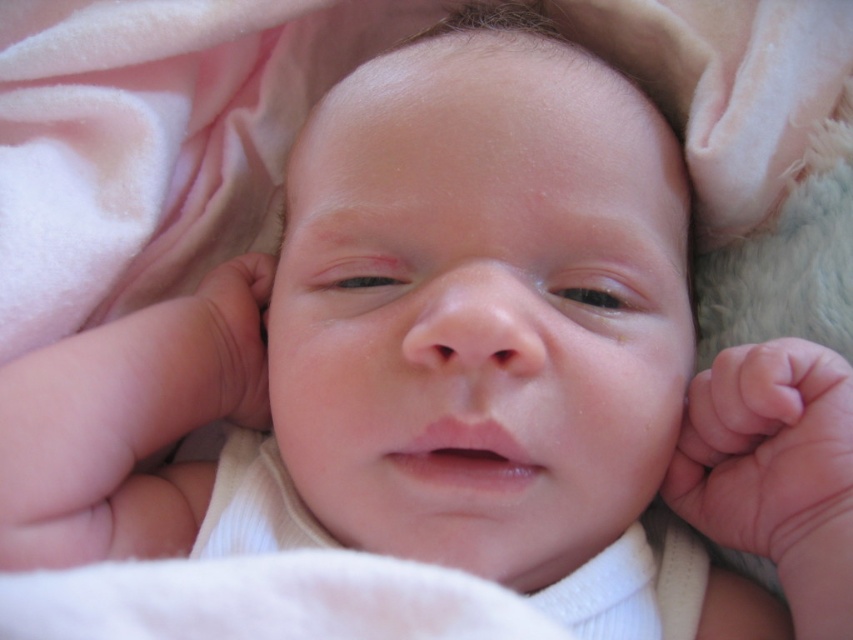
Question: Does pink soft skin at lower right lie behind pink soft skin at left?

Choices:
 (A) yes
 (B) no

Answer: (B)

Question: In this image, where is pink soft skin at lower right located relative to pink soft skin at left?

Choices:
 (A) left
 (B) right

Answer: (B)

Question: Among these objects, which one is nearest to the camera?

Choices:
 (A) pink soft skin at left
 (B) pink soft skin at lower right

Answer: (B)

Question: Which point is closer to the camera taking this photo?

Choices:
 (A) (766, 387)
 (B) (194, 314)

Answer: (A)

Question: Can you confirm if pink soft skin at lower right is wider than pink soft skin at left?

Choices:
 (A) yes
 (B) no

Answer: (A)

Question: Which point is farther to the camera?

Choices:
 (A) pink soft skin at left
 (B) pink soft skin at lower right

Answer: (A)